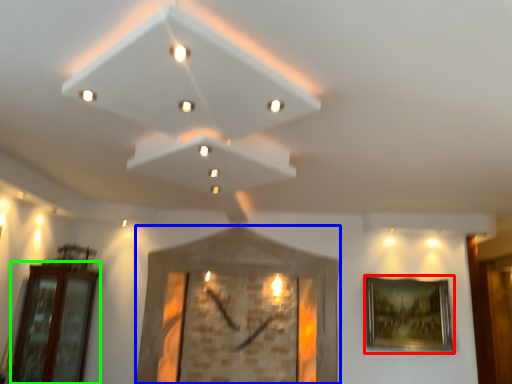
Question: Estimate the real-world distances between objects in this image. Which object is closer to picture frame (highlighted by a red box), picture frame (highlighted by a blue box) or glass door (highlighted by a green box)?

Choices:
 (A) picture frame
 (B) glass door

Answer: (A)